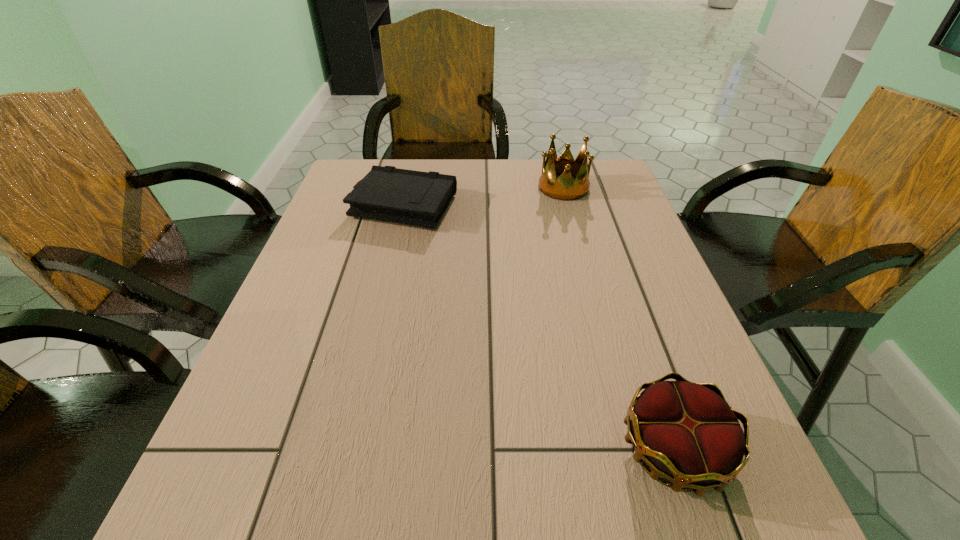
At what (x,y) coordinates should I click in order to perform the action: click on Bible present at the far edge. Please return your answer as a coordinate pair (x, y). The height and width of the screenshot is (540, 960). Looking at the image, I should click on (387, 193).

Where is `object at the near edge`? object at the near edge is located at coordinates (686, 432).

Find the location of a particular element. Image resolution: width=960 pixels, height=540 pixels. object present at the left edge is located at coordinates (387, 193).

I want to click on object that is at the far left corner, so click(x=387, y=193).

At what (x,y) coordinates should I click in order to perform the action: click on object present at the far right corner. Please return your answer as a coordinate pair (x, y). This screenshot has width=960, height=540. Looking at the image, I should click on (564, 188).

Find the location of a particular element. object located at the near right corner is located at coordinates (686, 432).

This screenshot has height=540, width=960. In the image, there is a desktop. Find the location of `vacant space at the far edge`. vacant space at the far edge is located at coordinates click(x=442, y=169).

Where is `vacant space at the near edge`? vacant space at the near edge is located at coordinates (495, 511).

In the image, there is a desktop. At what (x,y) coordinates should I click in order to perform the action: click on vacant region at the left edge. Please return your answer as a coordinate pair (x, y). Looking at the image, I should click on (227, 438).

Locate an element on the screen. The width and height of the screenshot is (960, 540). free space at the right edge of the desktop is located at coordinates (649, 339).